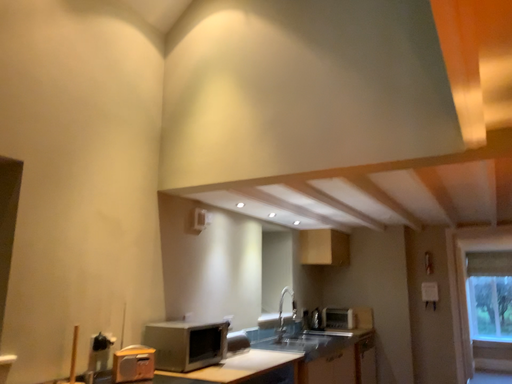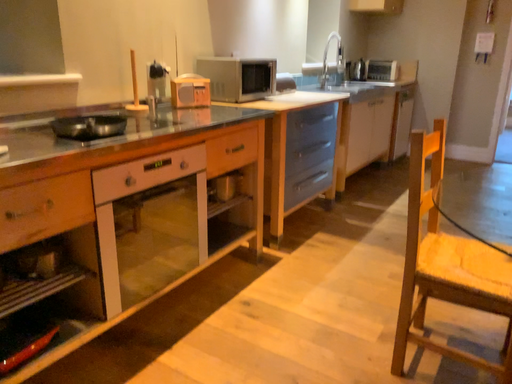
Question: How did the camera likely rotate when shooting the video?

Choices:
 (A) rotated upward
 (B) rotated downward

Answer: (B)